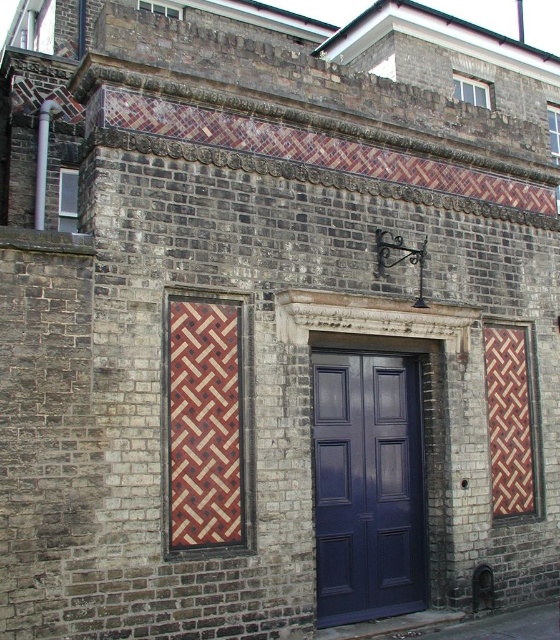
Locate an element on the screen. dull blue wood door at center is located at coordinates (367, 486).

Between point (361, 452) and point (232, 358), which one is positioned in front?

Positioned in front is point (232, 358).

Image resolution: width=560 pixels, height=640 pixels. Find the location of `dull blue wood door at center`. dull blue wood door at center is located at coordinates (367, 486).

Who is shorter, woven wood tapestry at center or woven wood panel at right?

With less height is woven wood tapestry at center.

Can you confirm if woven wood tapestry at center is positioned to the left of woven wood panel at right?

Correct, you'll find woven wood tapestry at center to the left of woven wood panel at right.

What do you see at coordinates (204, 424) in the screenshot?
I see `woven wood tapestry at center` at bounding box center [204, 424].

Identify the location of woven wood tapestry at center. (204, 424).

Who is more forward, (394,438) or (514,358)?

Positioned in front is point (394,438).

Consider the image. Who is more distant from viewer, (394, 467) or (526, 468)?

Point (526, 468)

Find the location of a particular element. Image resolution: width=560 pixels, height=640 pixels. dull blue wood door at center is located at coordinates (367, 486).